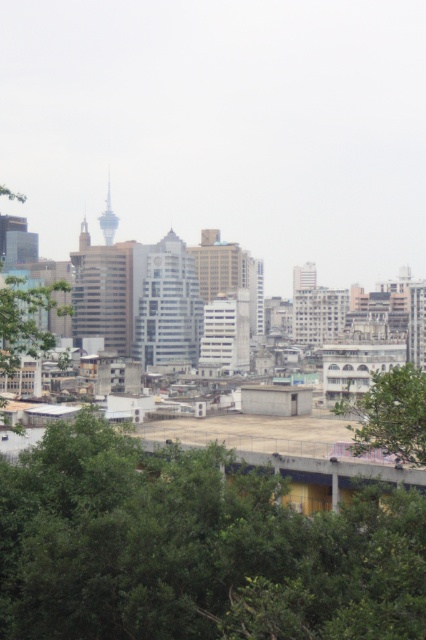
Describe the element at coordinates (391, 413) in the screenshot. The image size is (426, 640). I see `green leafy tree at center` at that location.

Does point (391, 372) lie in front of point (46, 288)?

Yes.

At what (x,y) coordinates should I click in order to perform the action: click on green leafy tree at center. Please return your answer as a coordinate pair (x, y). The width and height of the screenshot is (426, 640). Looking at the image, I should click on (391, 413).

Is green leafy tree at lower center below green leafy tree at center?

Yes.

Between green leafy tree at lower center and green leafy tree at center, which one is positioned higher?

green leafy tree at center

The image size is (426, 640). Describe the element at coordinates (195, 547) in the screenshot. I see `green leafy tree at lower center` at that location.

Image resolution: width=426 pixels, height=640 pixels. Find the location of `green leafy tree at lower center`. green leafy tree at lower center is located at coordinates point(195,547).

Is green leafy tree at lower center to the left of green leafy tree at left from the viewer's perspective?

No, green leafy tree at lower center is not to the left of green leafy tree at left.

Who is more distant from viewer, (x=23, y=460) or (x=0, y=353)?

Positioned behind is point (x=23, y=460).

Find the location of a particular element. Image resolution: width=426 pixels, height=640 pixels. green leafy tree at lower center is located at coordinates (195, 547).